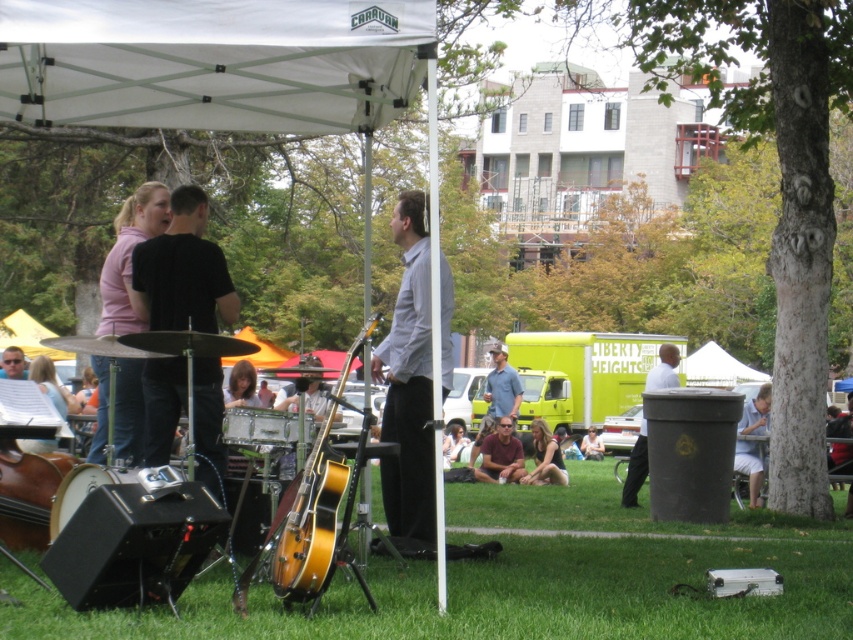
You are standing at the center of the image. You want to find the white cotton shirt at lower right. Which direction should you move to reach it?

You should move to the lower right direction to reach the white cotton shirt at lower right.

You are a photographer at the event and want to capture both the black matte shirt at center and the pink fabric shirt at upper left in a single frame. Which shirt should you focus on to ensure both are in the frame without zooming in?

The black matte shirt at center is smaller than the pink fabric shirt at upper left, so focusing on the pink fabric shirt at upper left would allow both shirts to fit in the frame without zooming in.